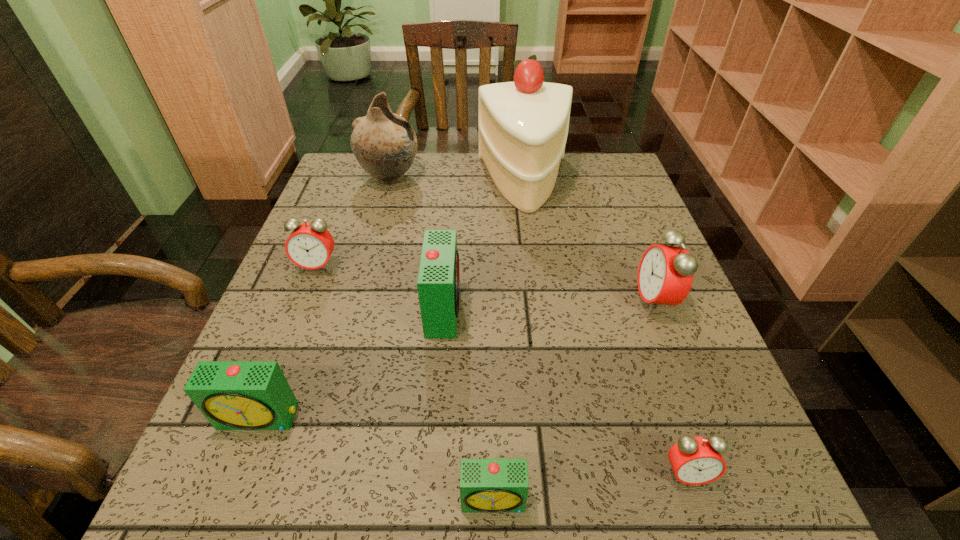
This screenshot has width=960, height=540. I want to click on cake that is at the far edge, so click(523, 125).

Identify the location of pottery present at the far edge. This screenshot has height=540, width=960. (385, 145).

Identify the location of pottery that is at the left edge. The height and width of the screenshot is (540, 960). pyautogui.click(x=385, y=145).

Where is `object that is at the far left corner`? object that is at the far left corner is located at coordinates (385, 145).

Identify the location of object located in the near right corner section of the desktop. (695, 460).

You are a GUI agent. You are given a task and a screenshot of the screen. Output one action in this format:
    pyautogui.click(x=<x>, y=<y>)
    Task: Click on the vacant space at the far edge
    
    Given the screenshot: What is the action you would take?
    pyautogui.click(x=424, y=185)

The height and width of the screenshot is (540, 960). Identify the location of vacant space at the near edge. (619, 511).

In the image, there is a desktop. Where is `vacant space at the left edge`? vacant space at the left edge is located at coordinates (261, 435).

The width and height of the screenshot is (960, 540). In the image, there is a desktop. Identify the location of vacant space at the right edge. (633, 314).

This screenshot has width=960, height=540. I want to click on blank space at the far left corner, so click(363, 180).